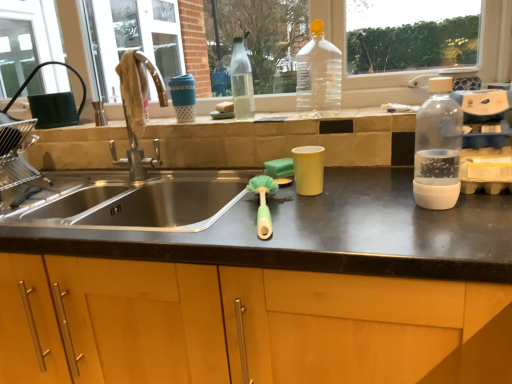
Locate an element on the screen. This screenshot has width=512, height=384. vacant space to the right of transparent plastic bottle at upper center, which is counted as the second bottle, starting from the front is located at coordinates (361, 112).